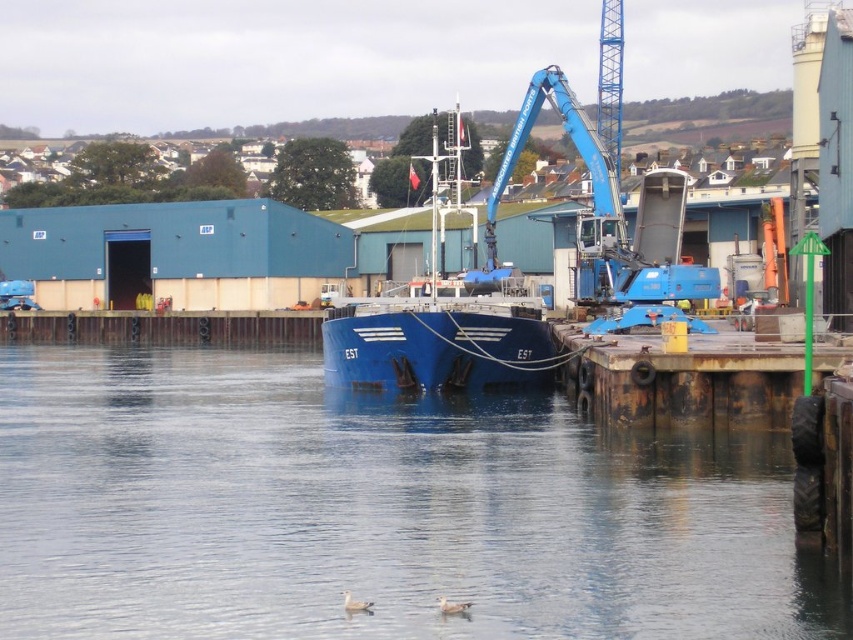
Question: Is transparent water at center in front of rusty metal dock at lower right?

Choices:
 (A) yes
 (B) no

Answer: (A)

Question: Which is farther from the white matte duck at lower center?

Choices:
 (A) white feathered duck at lower center
 (B) rusty metal dock at lower right

Answer: (B)

Question: Which point appears closest to the camera in this image?

Choices:
 (A) (793, 372)
 (B) (456, 611)

Answer: (B)

Question: Does rusty metal dock at lower right appear on the left side of white matte duck at lower center?

Choices:
 (A) no
 (B) yes

Answer: (A)

Question: Is transparent water at center to the left of white feathered duck at lower center from the viewer's perspective?

Choices:
 (A) no
 (B) yes

Answer: (B)

Question: Which object is closer to the camera taking this photo?

Choices:
 (A) white matte duck at lower center
 (B) white feathered duck at lower center
 (C) rusty metal dock at lower right

Answer: (B)